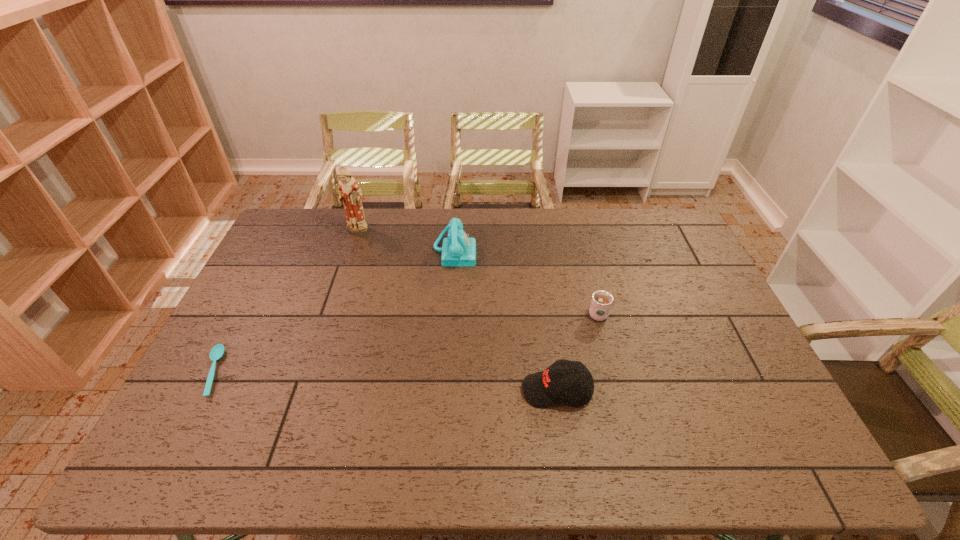
Locate an element on the screen. figurine is located at coordinates (350, 194).

Find the location of `the tallest object`. the tallest object is located at coordinates (350, 194).

Locate an element on the screen. Image resolution: width=960 pixels, height=540 pixels. telephone is located at coordinates (459, 250).

The image size is (960, 540). Find the location of `the third object from left to right`. the third object from left to right is located at coordinates (459, 250).

Locate an element on the screen. The image size is (960, 540). the third farthest object is located at coordinates (601, 302).

This screenshot has width=960, height=540. In order to click on cup in this screenshot , I will do `click(601, 302)`.

Where is `the second object from right to left`? the second object from right to left is located at coordinates (543, 389).

You are a GUI agent. You are given a task and a screenshot of the screen. Output one action in this format:
    pyautogui.click(x=<x>, y=<y>)
    Task: Click on the leftmost object
    
    Given the screenshot: What is the action you would take?
    pyautogui.click(x=216, y=353)

This screenshot has height=540, width=960. Find the location of `spoon`. spoon is located at coordinates (216, 353).

The height and width of the screenshot is (540, 960). What are the coordinates of `free point located 0.280m on the front-facing side of the fourth object from right to left` in the screenshot? It's located at (336, 294).